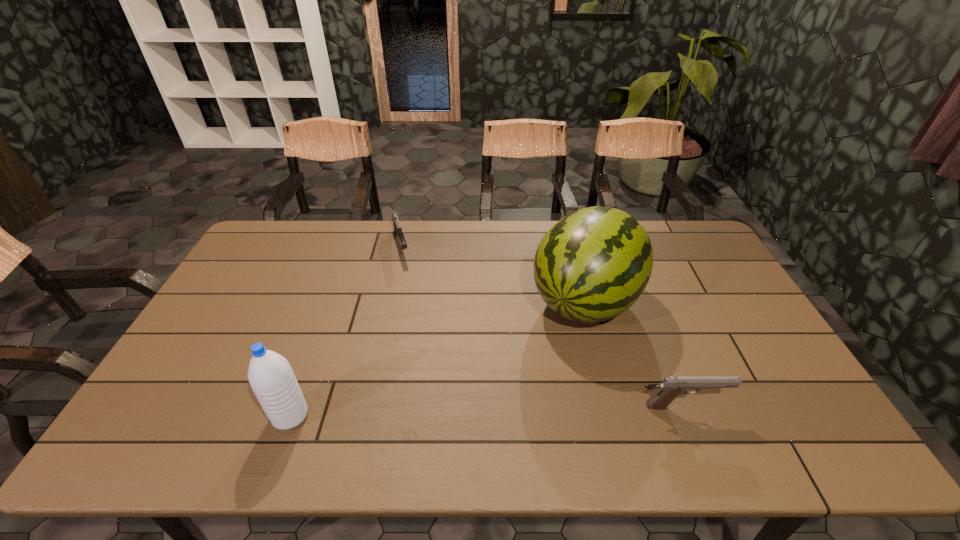
Locate an element on the screen. The image size is (960, 540). free space at the left edge is located at coordinates (242, 303).

Find the location of `vacant space at the right edge of the desktop`. vacant space at the right edge of the desktop is located at coordinates (716, 343).

This screenshot has height=540, width=960. I want to click on vacant region at the far left corner, so click(x=291, y=236).

In the image, there is a desktop. Identify the location of free space at the far right corner. The height and width of the screenshot is (540, 960). (672, 224).

The image size is (960, 540). In the image, there is a desktop. In order to click on vacant space at the near right corner in this screenshot , I will do `click(780, 406)`.

Identify the location of vacant area that lies between the gun and the second farthest object. The height and width of the screenshot is (540, 960). (493, 273).

Locate an element on the screen. vacant area between the pistol and the third nearest object is located at coordinates (635, 354).

What are the coordinates of `vacant area between the second shortest object and the leftmost object` in the screenshot? It's located at (488, 411).

Locate an element on the screen. The height and width of the screenshot is (540, 960). free point between the second farthest object and the pistol is located at coordinates (635, 354).

This screenshot has height=540, width=960. I want to click on vacant area between the watermelon and the leftmost object, so click(x=438, y=359).